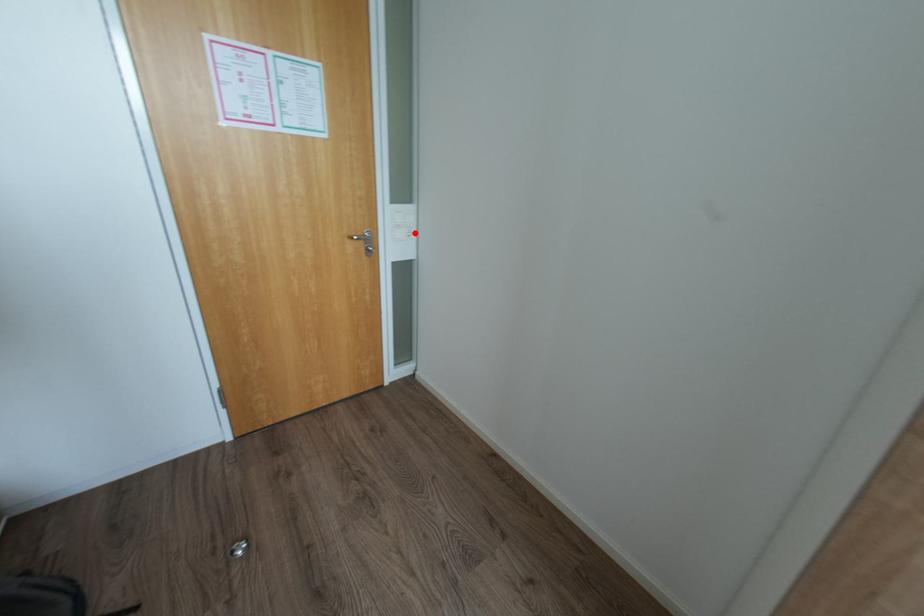
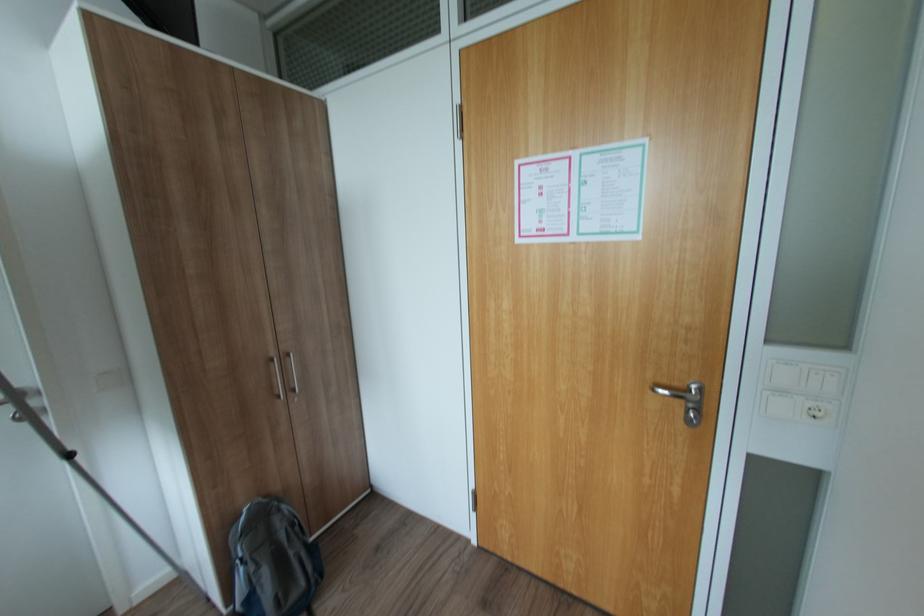
Question: I am providing you with two images of the same scene from different viewpoints. In image1, a red point is highlighted. Considering the same 3D point in image2, which of the following is correct?

Choices:
 (A) It is closer
 (B) It is farther

Answer: (B)